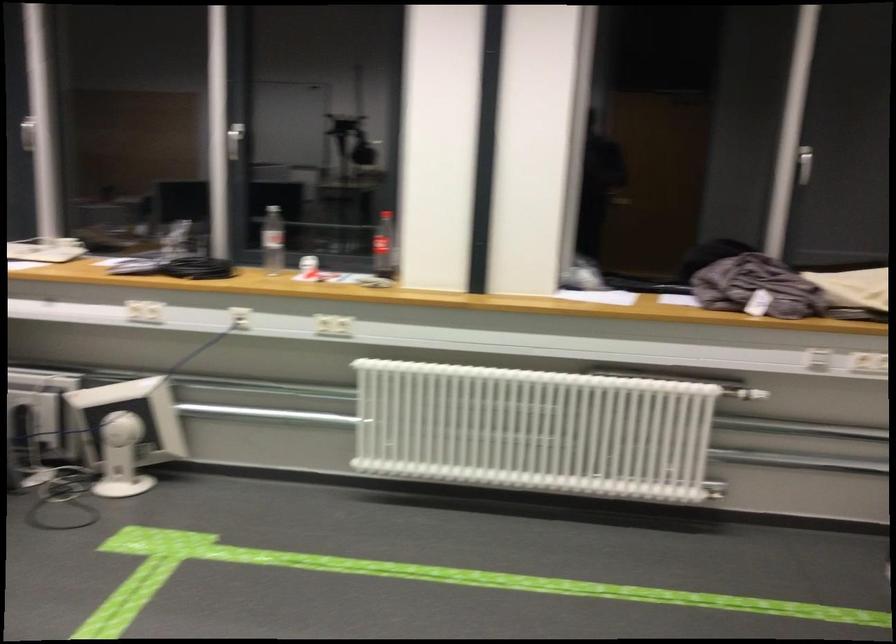
Find the location of a particular element. white desk fan is located at coordinates (126, 431).